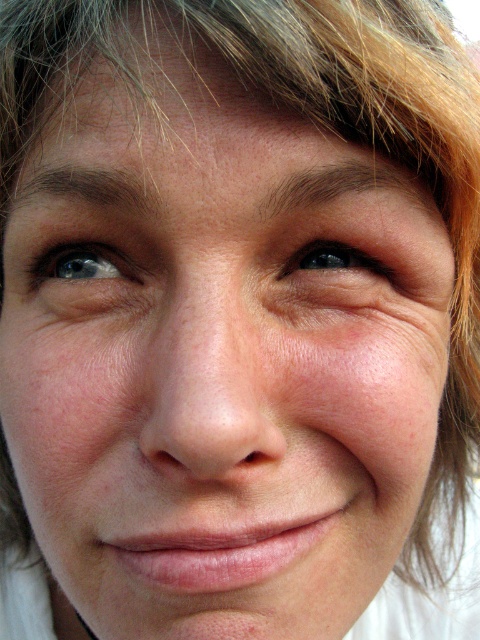
You are holding a camera and want to take a photo of a person. The camera is currently focused on the point at coordinates point (112,256). If the camera requires the focus point to be within 10 inches to capture a sharp image, will the photo be sharp?

The distance of point (112,256) from camera is 12.90 inches, so the photo will not be sharp because the focus point is beyond the 10 inches required for sharpness.

You are a photographer adjusting the focus of a camera lens. You need to ensure that both the blue glossy eye at upper left and the black glossy eye at upper center are in focus. The camera can only focus on objects within a 2.5 inch range. Will both eyes be in focus?

The blue glossy eye at upper left and black glossy eye at upper center are 2.43 inches apart from each other. Since the distance between them is less than the camera focus range of 2.5 inches, both eyes will be in focus.

You are an artist trying to paint this portrait. You need to decide which of the two points, point (38, 284) or point (288, 260), is closer to the viewer. Based on the image, which point should you paint with more detail to emphasize depth?

Point (38, 284) is further to the viewer than point (288, 260), so you should paint point (38, 284) with more detail to emphasize depth.